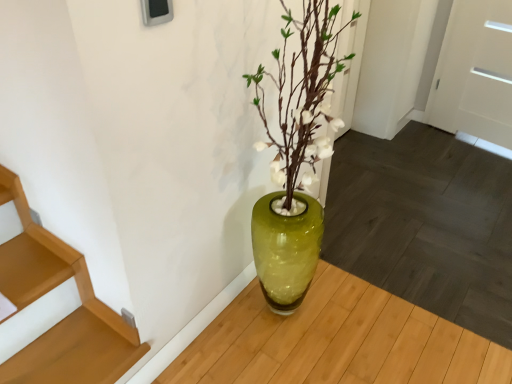
Find the location of `white matte door at upper right`. white matte door at upper right is located at coordinates (475, 73).

What do you see at coordinates (475, 73) in the screenshot? I see `white matte door at upper right` at bounding box center [475, 73].

This screenshot has height=384, width=512. Describe the element at coordinates (74, 354) in the screenshot. I see `wooden stairs at lower left` at that location.

In order to face wooden stairs at lower left, should I rotate leftwards or rightwards?

To align with it, rotate left about 22.745°.

The width and height of the screenshot is (512, 384). I want to click on wooden stairs at lower left, so click(x=74, y=354).

Locate an element on the screen. white matte door at upper right is located at coordinates (475, 73).

Consider the image. Which is more to the left, wooden stairs at lower left or white matte door at upper right?

wooden stairs at lower left.

Relative to white matte door at upper right, is wooden stairs at lower left in front or behind?

wooden stairs at lower left is positioned closer to the viewer than white matte door at upper right.

Considering the positions of points (8, 379) and (444, 63), is point (8, 379) farther from camera compared to point (444, 63)?

No, (8, 379) is in front of (444, 63).

From the image's perspective, which one is positioned higher, wooden stairs at lower left or white matte door at upper right?

white matte door at upper right, from the image's perspective.

Looking at this image, from a real-world perspective, who is located lower, wooden stairs at lower left or white matte door at upper right?

wooden stairs at lower left.

Looking at their sizes, would you say wooden stairs at lower left is wider or thinner than white matte door at upper right?

wooden stairs at lower left is wider than white matte door at upper right.

Considering the sizes of objects wooden stairs at lower left and white matte door at upper right in the image provided, who is shorter, wooden stairs at lower left or white matte door at upper right?

Standing shorter between the two is wooden stairs at lower left.

Which of these two, wooden stairs at lower left or white matte door at upper right, is bigger?

white matte door at upper right is bigger.

In the scene shown: Is wooden stairs at lower left inside the boundaries of white matte door at upper right, or outside?

wooden stairs at lower left is not enclosed by white matte door at upper right.

Is wooden stairs at lower left not close to white matte door at upper right?

Absolutely, wooden stairs at lower left is distant from white matte door at upper right.

Is wooden stairs at lower left facing away from white matte door at upper right?

wooden stairs at lower left is not turned away from white matte door at upper right.

How different are the orientations of wooden stairs at lower left and white matte door at upper right in degrees?

The angle between the facing direction of wooden stairs at lower left and the facing direction of white matte door at upper right is 113 degrees.

Find the location of `door above the wooden stairs at lower left (from the image's perspective)`. door above the wooden stairs at lower left (from the image's perspective) is located at coordinates click(475, 73).

In the scene shown: Can you confirm if white matte door at upper right is positioned to the left of wooden stairs at lower left?

Incorrect, white matte door at upper right is not on the left side of wooden stairs at lower left.

Is white matte door at upper right in front of wooden stairs at lower left?

That is False.

Does point (509, 60) lie behind point (90, 379)?

Yes, point (509, 60) is farther from viewer.

From the image's perspective, who appears lower, white matte door at upper right or wooden stairs at lower left?

wooden stairs at lower left is shown below in the image.

From a real-world perspective, which object stands above the other?

From a 3D spatial view, white matte door at upper right is above.

Which of these two, white matte door at upper right or wooden stairs at lower left, is thinner?

white matte door at upper right is thinner.

Considering the sizes of white matte door at upper right and wooden stairs at lower left in the image, is white matte door at upper right taller or shorter than wooden stairs at lower left?

In the image, white matte door at upper right appears to be taller than wooden stairs at lower left.

Can you confirm if white matte door at upper right is smaller than wooden stairs at lower left?

Incorrect, white matte door at upper right is not smaller in size than wooden stairs at lower left.

Can wooden stairs at lower left be found inside white matte door at upper right?

No, wooden stairs at lower left is not surrounded by white matte door at upper right.

Would you consider white matte door at upper right to be distant from wooden stairs at lower left?

Indeed, white matte door at upper right is not near wooden stairs at lower left.

Consider the image. Is white matte door at upper right turned away from wooden stairs at lower left?

No, white matte door at upper right's orientation is not away from wooden stairs at lower left.

How different are the orientations of white matte door at upper right and wooden stairs at lower left in degrees?

The angular difference between white matte door at upper right and wooden stairs at lower left is 113 degrees.

In order to click on door above the wooden stairs at lower left (from the image's perspective) in this screenshot , I will do `click(475, 73)`.

Find the location of a particular element. The width and height of the screenshot is (512, 384). stairs located underneath the white matte door at upper right (from a real-world perspective) is located at coordinates (74, 354).

The image size is (512, 384). In order to click on door that appears behind the wooden stairs at lower left in this screenshot , I will do `click(475, 73)`.